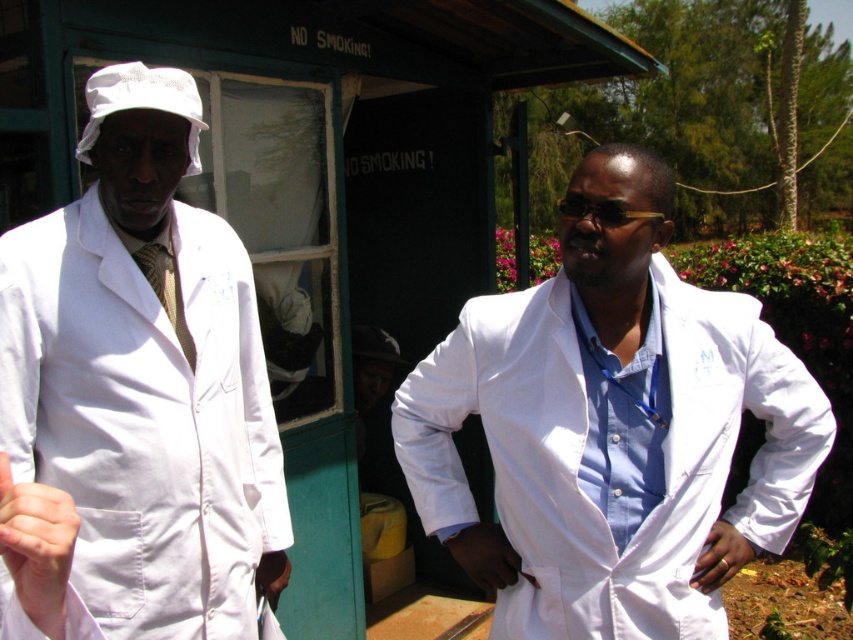
Question: Which point is closer to the camera?

Choices:
 (A) (421, 451)
 (B) (9, 449)

Answer: (B)

Question: Does white matte lab coat at right appear over white matte lab coat at left?

Choices:
 (A) yes
 (B) no

Answer: (B)

Question: Does white matte lab coat at right appear under white matte lab coat at left?

Choices:
 (A) yes
 (B) no

Answer: (A)

Question: Which point is closer to the camera?

Choices:
 (A) (222, 349)
 (B) (538, 349)

Answer: (B)

Question: Does white matte lab coat at right come behind white matte lab coat at left?

Choices:
 (A) yes
 (B) no

Answer: (A)